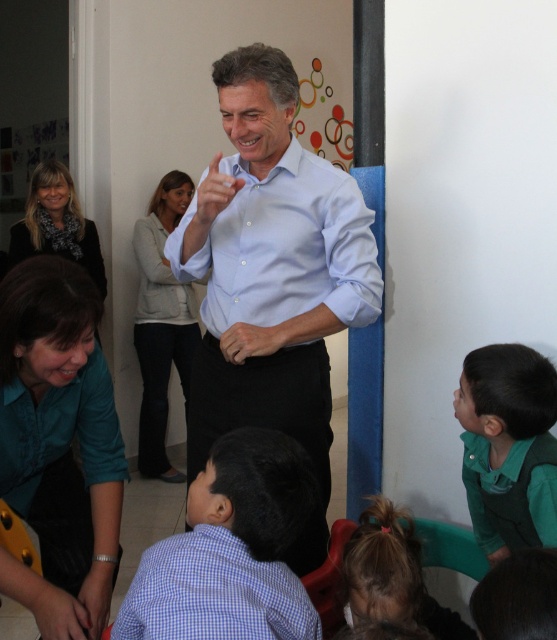
Does light blue cotton shirt at center have a lesser height compared to brown hair at lower center?

Incorrect, light blue cotton shirt at center's height does not fall short of brown hair at lower center's.

Locate an element on the screen. The height and width of the screenshot is (640, 557). light blue cotton shirt at center is located at coordinates (285, 246).

This screenshot has height=640, width=557. Find the location of `light blue cotton shirt at center`. light blue cotton shirt at center is located at coordinates (285, 246).

Locate an element on the screen. This screenshot has width=557, height=640. light blue shirt at center is located at coordinates (276, 276).

The image size is (557, 640). What do you see at coordinates (276, 276) in the screenshot?
I see `light blue shirt at center` at bounding box center [276, 276].

Locate an element on the screen. Image resolution: width=557 pixels, height=640 pixels. light blue shirt at center is located at coordinates (276, 276).

Between green matte shirt at lower right and brown hair at lower center, which one is positioned higher?

green matte shirt at lower right is above.

Does green matte shirt at lower right have a greater width compared to brown hair at lower center?

No.

Measure the distance between point (531, 429) and camera.

Point (531, 429) and camera are 4.50 feet apart.

The height and width of the screenshot is (640, 557). In order to click on green matte shirt at lower right in this screenshot , I will do `click(500, 426)`.